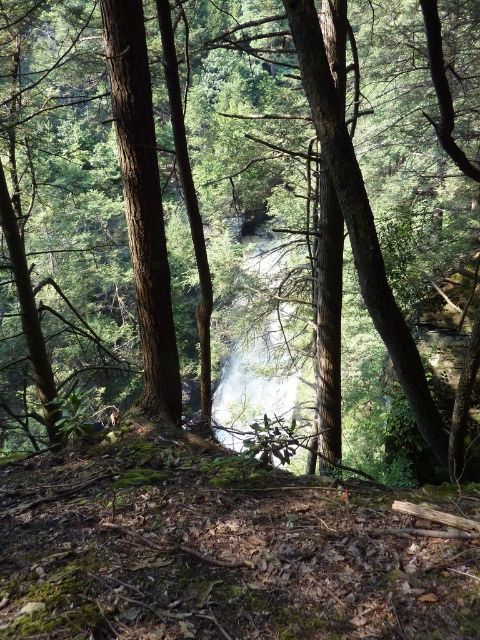
Question: Does smooth brown tree trunk at center appear over white misty waterfall at center?

Choices:
 (A) yes
 (B) no

Answer: (A)

Question: Which point is closer to the camera?

Choices:
 (A) white misty waterfall at center
 (B) smooth brown tree trunk at center

Answer: (B)

Question: Observing the image, what is the correct spatial positioning of smooth brown tree trunk at center in reference to white misty waterfall at center?

Choices:
 (A) left
 (B) right

Answer: (A)

Question: Does smooth brown tree trunk at center have a lesser width compared to white misty waterfall at center?

Choices:
 (A) no
 (B) yes

Answer: (B)

Question: Which point appears closest to the camera in this image?

Choices:
 (A) (123, 173)
 (B) (288, 308)

Answer: (A)